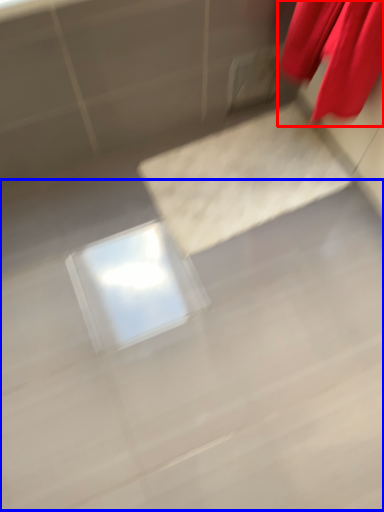
Question: Which of the following is the closest to the observer, curtain (highlighted by a red box) or concrete (highlighted by a blue box)?

Choices:
 (A) curtain
 (B) concrete

Answer: (A)